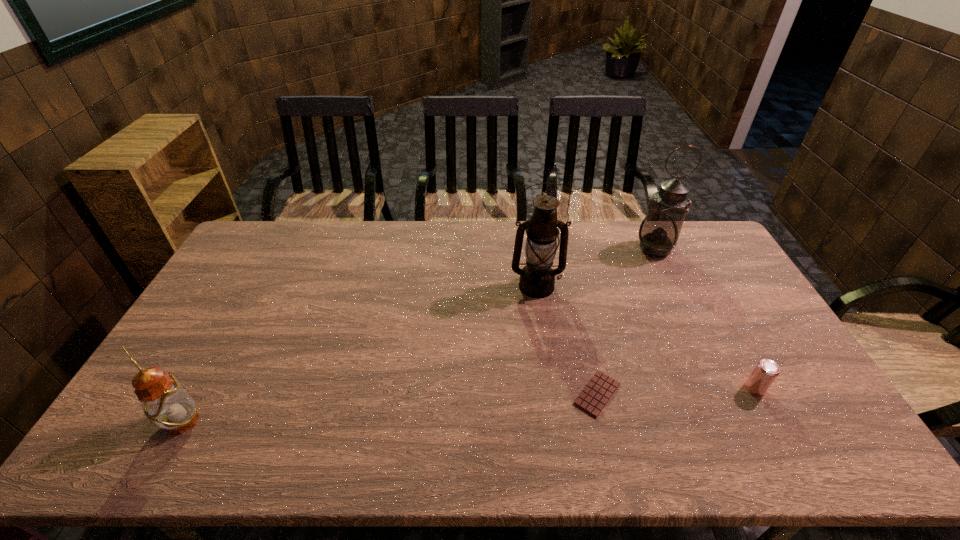
At what (x,y) coordinates should I click in order to perform the action: click on vacant space at the left edge. Please return your answer as a coordinate pair (x, y). The height and width of the screenshot is (540, 960). Looking at the image, I should click on (275, 262).

Image resolution: width=960 pixels, height=540 pixels. What are the coordinates of `free area in between the second oil lamp from left to right and the candy bar` in the screenshot? It's located at (566, 340).

Locate an element on the screen. Image resolution: width=960 pixels, height=540 pixels. vacant area between the shortest oil lamp and the second oil lamp from left to right is located at coordinates (359, 354).

Image resolution: width=960 pixels, height=540 pixels. Find the location of `unoccupied position between the second farthest oil lamp and the fourth tallest object`. unoccupied position between the second farthest oil lamp and the fourth tallest object is located at coordinates (646, 337).

You are a GUI agent. You are given a task and a screenshot of the screen. Output one action in this format:
    pyautogui.click(x=<x>, y=<y>)
    Task: Click on the free space between the beer can and the rightmost oil lamp
    
    Given the screenshot: What is the action you would take?
    pyautogui.click(x=705, y=319)

You are a GUI agent. You are given a task and a screenshot of the screen. Output one action in this format:
    pyautogui.click(x=<x>, y=<y>)
    Task: Click on the blank region between the farthest object and the second nearest oil lamp
    This screenshot has height=540, width=960.
    Given the screenshot: What is the action you would take?
    pyautogui.click(x=595, y=268)

Locate an element on the screen. Image resolution: width=960 pixels, height=540 pixels. vacant area that lies between the beer can and the second oil lamp from left to right is located at coordinates (646, 337).

At what (x,y) coordinates should I click in order to perform the action: click on free spot between the candy bar and the fourth nearest object. Please return your answer as a coordinate pair (x, y). The image size is (960, 540). Looking at the image, I should click on (566, 340).

You are a GUI agent. You are given a task and a screenshot of the screen. Output one action in this format:
    pyautogui.click(x=<x>, y=<y>)
    Task: Click on the vacant region between the second farthest oil lamp and the leftmost oil lamp
    This screenshot has height=540, width=960.
    Given the screenshot: What is the action you would take?
    pyautogui.click(x=359, y=354)

Find the location of a particular element. Image resolution: width=960 pixels, height=540 pixels. vacant region between the shortest object and the second farthest object is located at coordinates (566, 340).